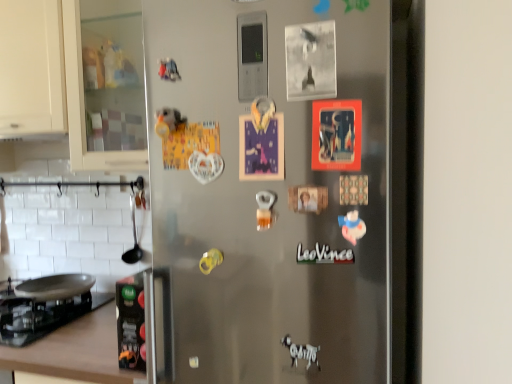
Question: Considering the relative positions of black glass gas stove at lower left and satin silver fridge at center in the image provided, is black glass gas stove at lower left to the left of satin silver fridge at center from the viewer's perspective?

Choices:
 (A) no
 (B) yes

Answer: (B)

Question: Does black glass gas stove at lower left lie behind satin silver fridge at center?

Choices:
 (A) yes
 (B) no

Answer: (A)

Question: Can you confirm if black glass gas stove at lower left is smaller than satin silver fridge at center?

Choices:
 (A) yes
 (B) no

Answer: (B)

Question: Is black glass gas stove at lower left directly adjacent to satin silver fridge at center?

Choices:
 (A) no
 (B) yes

Answer: (A)

Question: Is satin silver fridge at center located within black glass gas stove at lower left?

Choices:
 (A) no
 (B) yes

Answer: (A)

Question: Is black glass gas stove at lower left oriented away from satin silver fridge at center?

Choices:
 (A) no
 (B) yes

Answer: (A)

Question: Can you confirm if brown wood countertop at lower left is bigger than matte white text at center?

Choices:
 (A) yes
 (B) no

Answer: (A)

Question: Is the depth of brown wood countertop at lower left less than that of matte white text at center?

Choices:
 (A) no
 (B) yes

Answer: (A)

Question: Considering the relative sizes of brown wood countertop at lower left and matte white text at center in the image provided, is brown wood countertop at lower left wider than matte white text at center?

Choices:
 (A) no
 (B) yes

Answer: (B)

Question: From a real-world perspective, is brown wood countertop at lower left located higher than matte white text at center?

Choices:
 (A) no
 (B) yes

Answer: (A)

Question: Is brown wood countertop at lower left behind matte white text at center?

Choices:
 (A) no
 (B) yes

Answer: (B)

Question: From a real-world perspective, is brown wood countertop at lower left physically below matte white text at center?

Choices:
 (A) yes
 (B) no

Answer: (A)

Question: Would you say satin silver fridge at center is part of matte white text at center's contents?

Choices:
 (A) yes
 (B) no

Answer: (B)